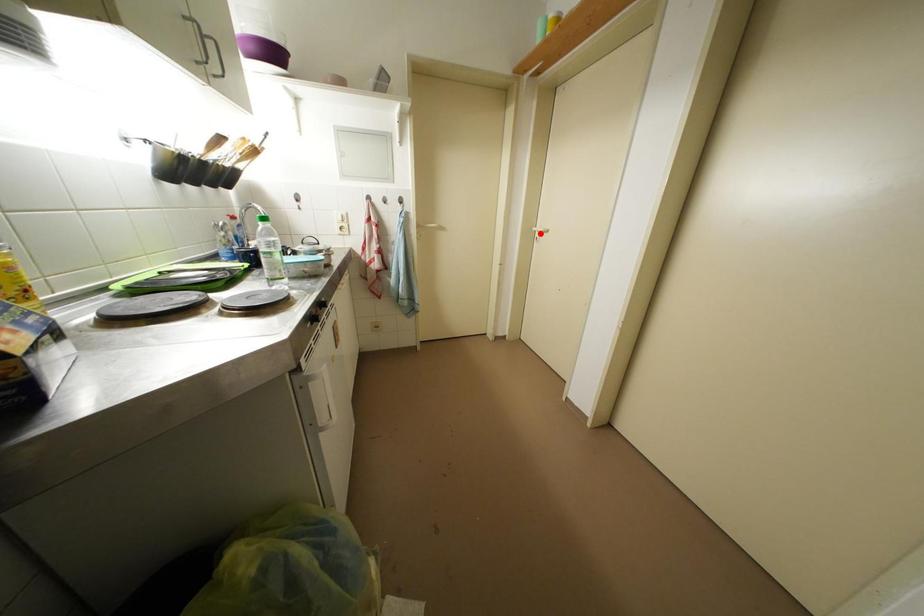
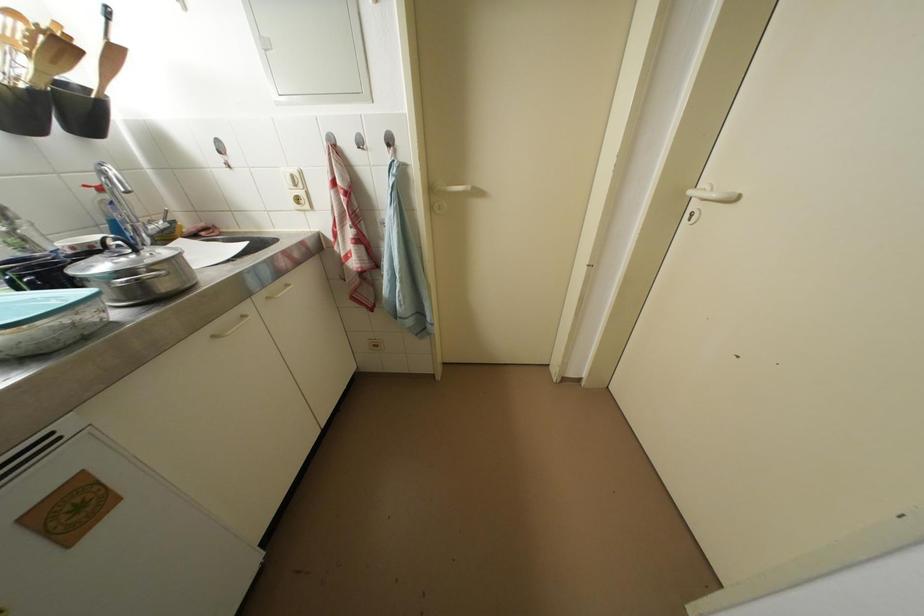
The point at the highlighted location is marked in the first image. Where is the corresponding point in the second image?

(698, 197)